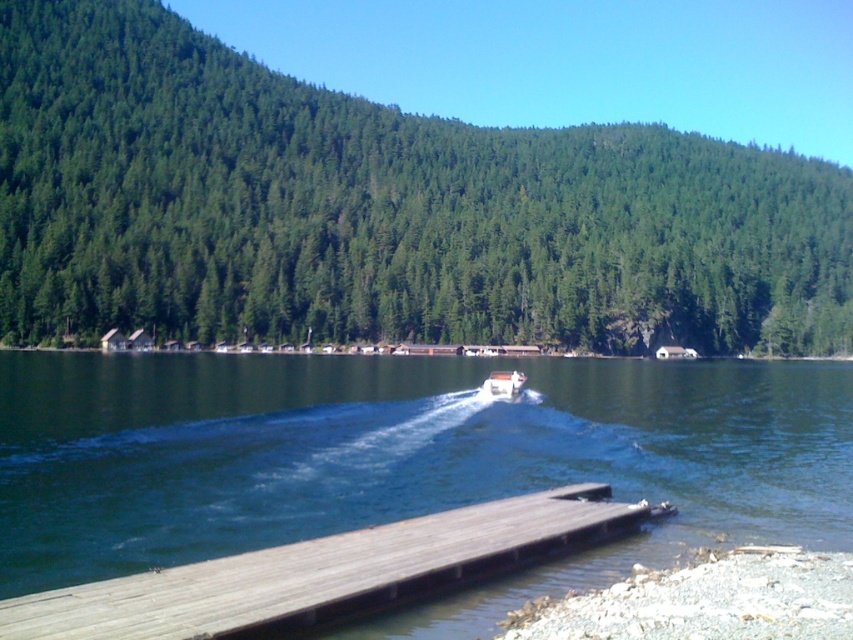
Question: In this image, where is wooden dock at lower center located relative to smooth gravel shore at lower right?

Choices:
 (A) left
 (B) right

Answer: (A)

Question: Estimate the real-world distances between objects in this image. Which object is farther from the smooth gravel shore at lower right?

Choices:
 (A) white plastic boat at center
 (B) green matte forest at upper center

Answer: (B)

Question: Which of the following is the farthest from the observer?

Choices:
 (A) smooth gravel shore at lower right
 (B) clear blue water at center

Answer: (A)

Question: Estimate the real-world distances between objects in this image. Which object is farther from the clear blue water at center?

Choices:
 (A) green matte forest at upper center
 (B) wooden dock at lower center
 (C) white plastic boat at center
 (D) smooth gravel shore at lower right

Answer: (A)

Question: Is smooth gravel shore at lower right smaller than white plastic boat at center?

Choices:
 (A) yes
 (B) no

Answer: (A)

Question: Considering the relative positions of clear blue water at center and smooth gravel shore at lower right in the image provided, where is clear blue water at center located with respect to smooth gravel shore at lower right?

Choices:
 (A) above
 (B) below

Answer: (B)